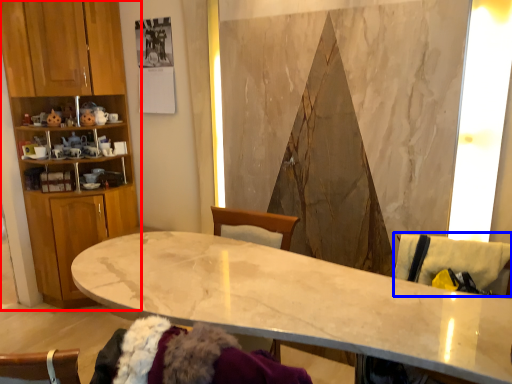
Question: Which object appears farthest to the camera in this image, cabinetry (highlighted by a red box) or swivel chair (highlighted by a blue box)?

Choices:
 (A) cabinetry
 (B) swivel chair

Answer: (A)